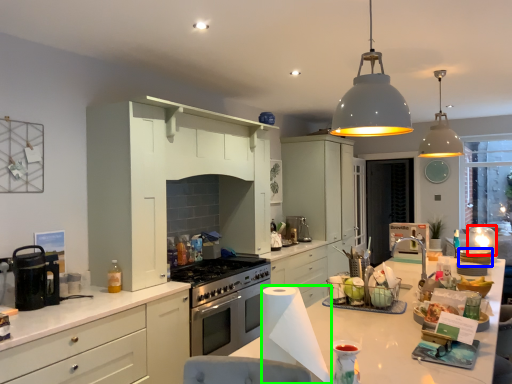
Question: Which is farther away from appliance (highlighted by a red box)? appliance (highlighted by a blue box) or paper towel (highlighted by a green box)?

Choices:
 (A) appliance
 (B) paper towel

Answer: (B)